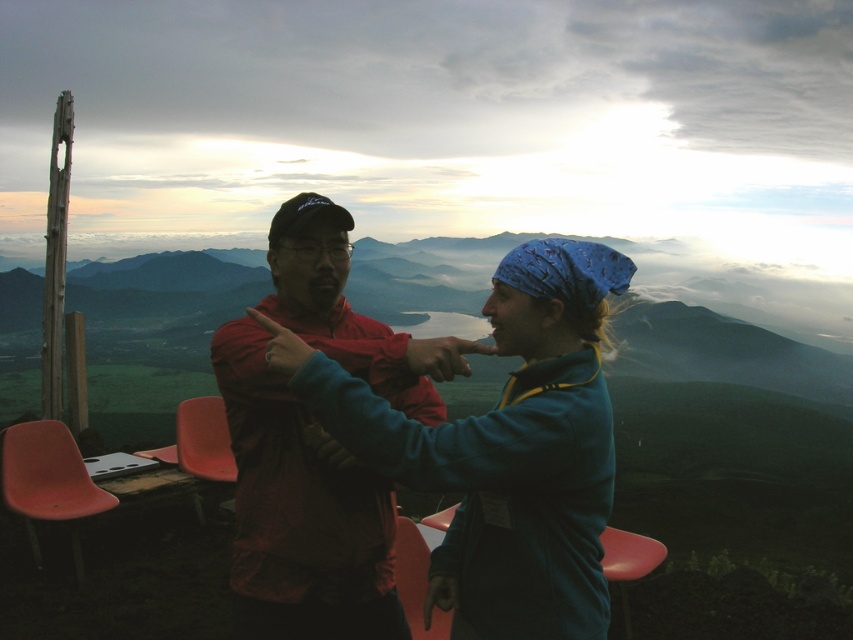
Question: Which point appears closest to the camera in this image?

Choices:
 (A) (105, 499)
 (B) (386, 392)
 (C) (425, 570)

Answer: (B)

Question: Which point appears farthest from the camera in this image?

Choices:
 (A) (178, 404)
 (B) (413, 557)
 (C) (613, 573)

Answer: (A)

Question: Is blue bandana at center further to the viewer compared to matte orange chair at lower left?

Choices:
 (A) yes
 (B) no

Answer: (B)

Question: In this image, where is blue bandana at center located relative to matte red jacket at center?

Choices:
 (A) left
 (B) right

Answer: (B)

Question: Is matte plastic chair at lower left closer to camera compared to pink plastic chair at lower center?

Choices:
 (A) no
 (B) yes

Answer: (A)

Question: Which point is closer to the camera?

Choices:
 (A) blue bandana at center
 (B) matte plastic chair at lower center
 (C) matte red jacket at center
 (D) matte orange chair at lower left

Answer: (A)